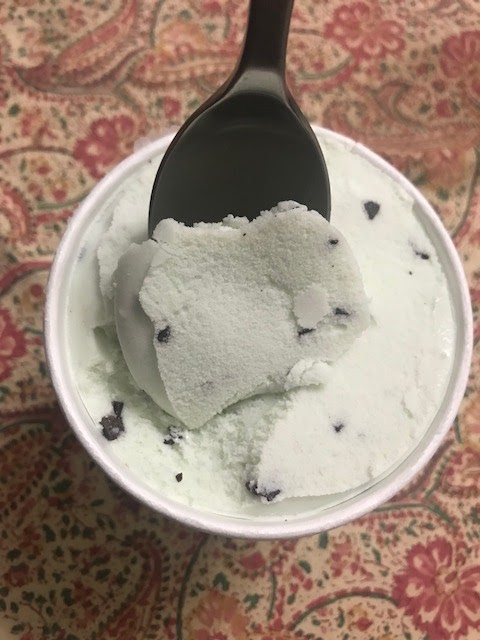
At what (x,y) coordinates should I click in order to perform the action: click on floor. Please return your answer as a coordinate pair (x, y). The width and height of the screenshot is (480, 640). Looking at the image, I should click on (42, 508).